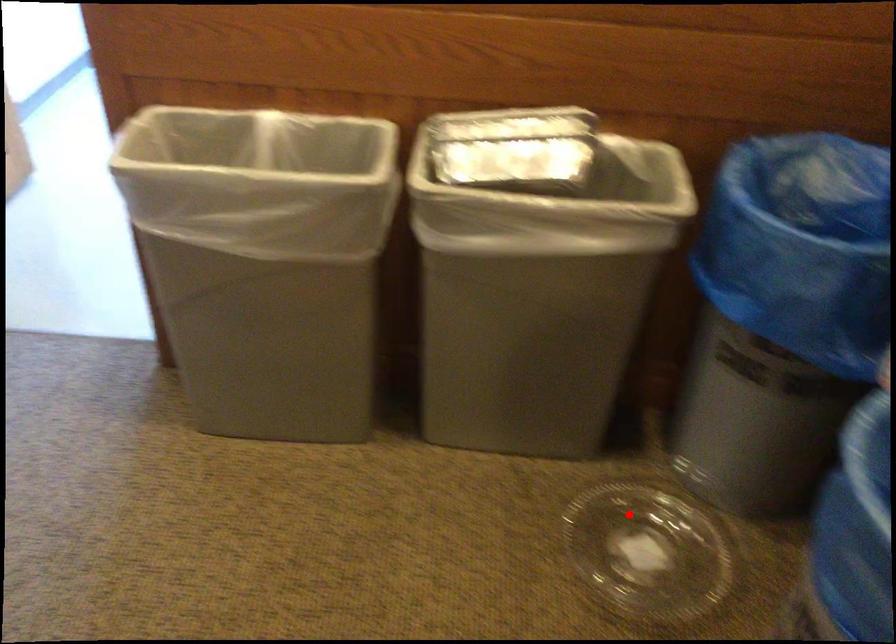
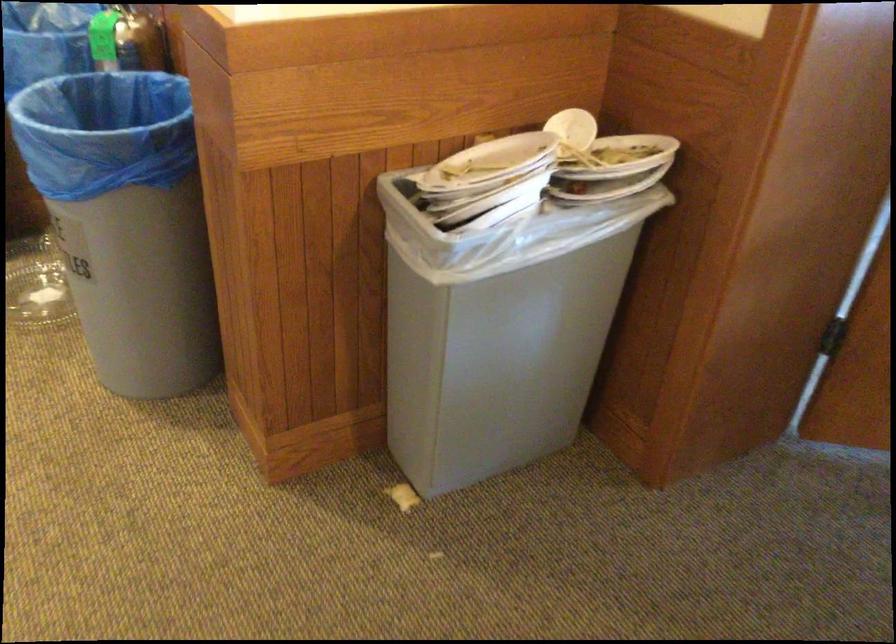
In the second image, find the point that corresponds to the highlighted location in the first image.

(36, 285)